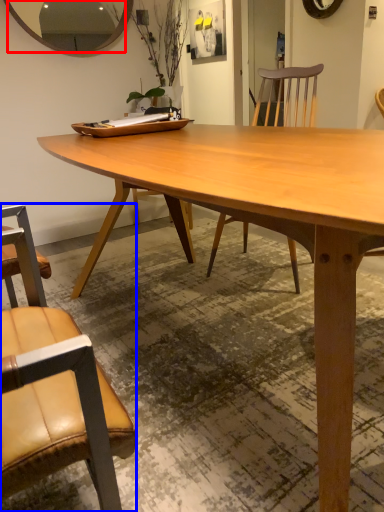
Question: Among these objects, which one is farthest to the camera, mirror (highlighted by a red box) or chair (highlighted by a blue box)?

Choices:
 (A) mirror
 (B) chair

Answer: (A)